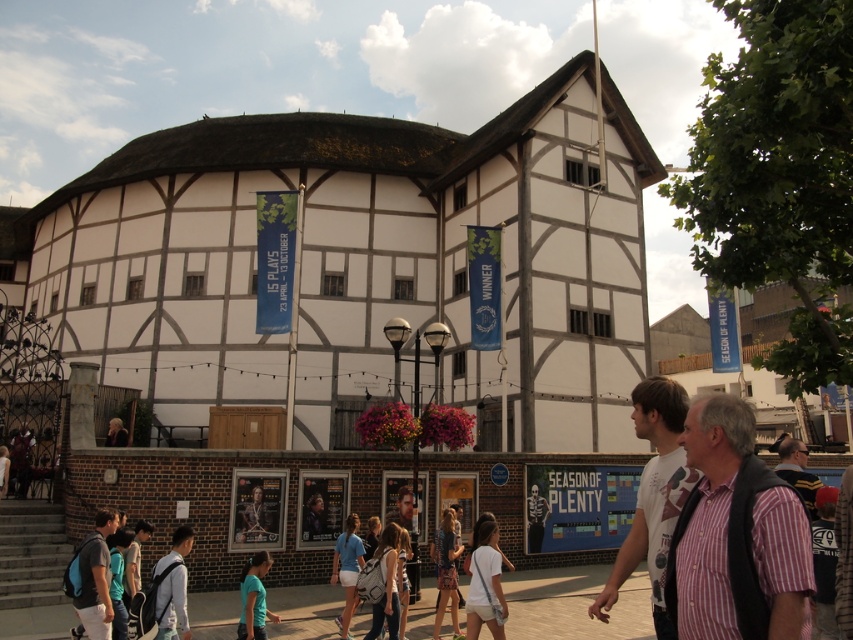
Question: Can you confirm if white fabric backpack at lower left is thinner than blonde hair at lower left?

Choices:
 (A) yes
 (B) no

Answer: (A)

Question: Which point appears closest to the camera in this image?

Choices:
 (A) (457, 552)
 (B) (90, 564)
 (C) (352, 550)
 (D) (183, 589)

Answer: (D)

Question: Is printed cotton dress at center below blue fabric shirt at center?

Choices:
 (A) no
 (B) yes

Answer: (A)

Question: Which of the following is the farthest from the observer?

Choices:
 (A) white cotton shirt at center
 (B) light blue backpack at lower left

Answer: (A)

Question: Does light blue backpack at lower left have a lesser width compared to white fabric backpack at center?

Choices:
 (A) no
 (B) yes

Answer: (B)

Question: Which point appears closest to the camera in this image?

Choices:
 (A) (448, 515)
 (B) (178, 531)

Answer: (B)